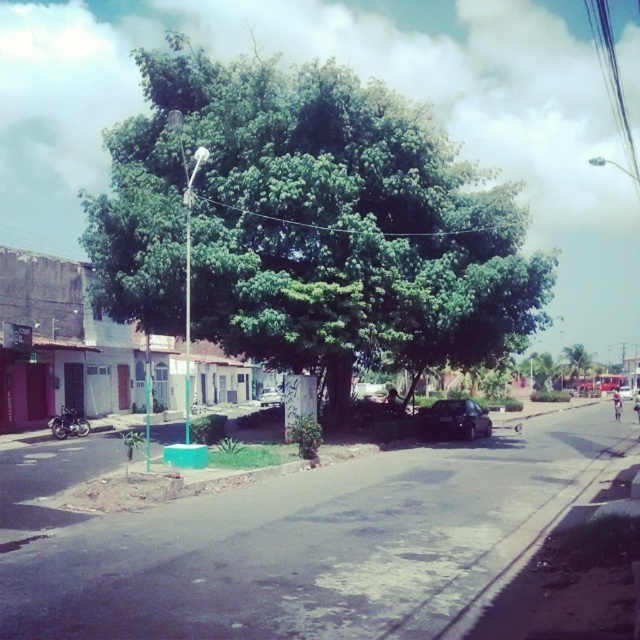
Question: Considering the real-world distances, which object is farthest from the black matte car at center?

Choices:
 (A) metallic silver car at center
 (B) green leafy tree at center

Answer: (A)

Question: Can you confirm if green leafy tree at center is positioned below black matte car at center?

Choices:
 (A) yes
 (B) no

Answer: (B)

Question: Based on their relative distances, which object is farther from the silver metallic car at center?

Choices:
 (A) metallic silver car at center
 (B) black matte car at center

Answer: (A)

Question: Considering the real-world distances, which object is farthest from the metallic silver car at center?

Choices:
 (A) black matte car at center
 (B) green leafy tree at center
 (C) silver metallic car at center

Answer: (B)

Question: Does green leafy tree at center appear under black matte car at center?

Choices:
 (A) yes
 (B) no

Answer: (B)

Question: Is green leafy tree at center below silver metallic car at center?

Choices:
 (A) yes
 (B) no

Answer: (B)